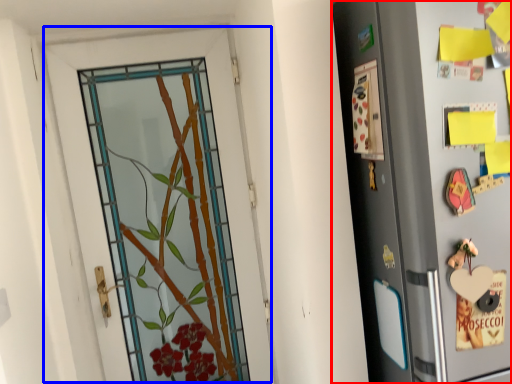
Question: Which object appears closest to the camera in this image, refrigerator (highlighted by a red box) or door (highlighted by a blue box)?

Choices:
 (A) refrigerator
 (B) door

Answer: (A)